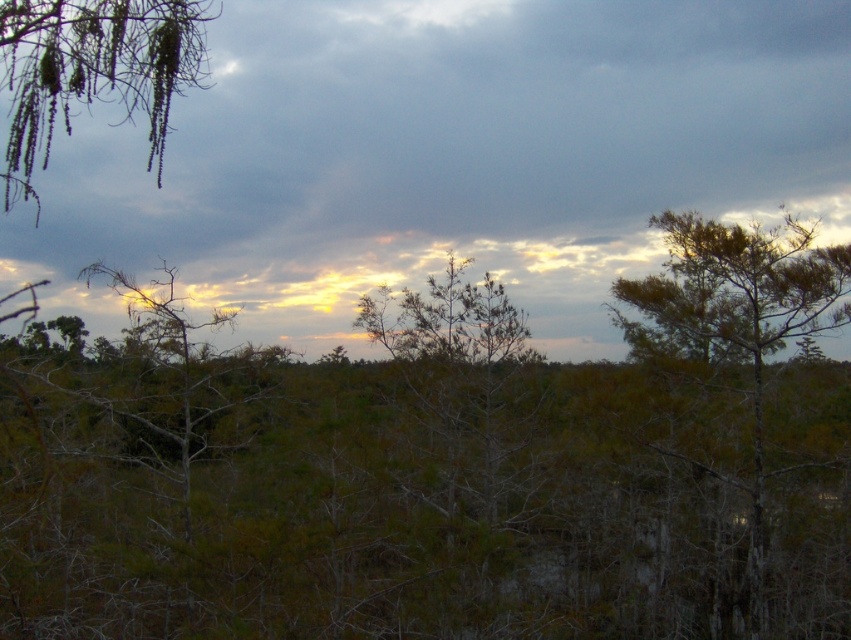
Does cloudy sky at upper center appear over green textured tree at center?

Correct, cloudy sky at upper center is located above green textured tree at center.

Find the location of a particular element. This screenshot has height=640, width=851. cloudy sky at upper center is located at coordinates (448, 156).

Is point (264, 221) farther from camera compared to point (501, 394)?

Yes, it is behind point (501, 394).

I want to click on cloudy sky at upper center, so click(x=448, y=156).

Based on the photo, who is higher up, green matte hanging branches at upper left or green textured tree at right?

Positioned higher is green matte hanging branches at upper left.

Does green matte hanging branches at upper left appear on the right side of green textured tree at right?

Incorrect, green matte hanging branches at upper left is not on the right side of green textured tree at right.

The image size is (851, 640). Identify the location of green matte hanging branches at upper left. (93, 68).

Who is shorter, green matte tree at center or cloudy sky at upper center?

With less height is green matte tree at center.

Which is behind, point (581, 387) or point (597, 92)?

Positioned behind is point (597, 92).

At what (x,y) coordinates should I click in order to perform the action: click on green matte tree at center. Please return your answer as a coordinate pair (x, y). Looking at the image, I should click on (444, 474).

Image resolution: width=851 pixels, height=640 pixels. In order to click on green matte tree at center in this screenshot , I will do `click(444, 474)`.